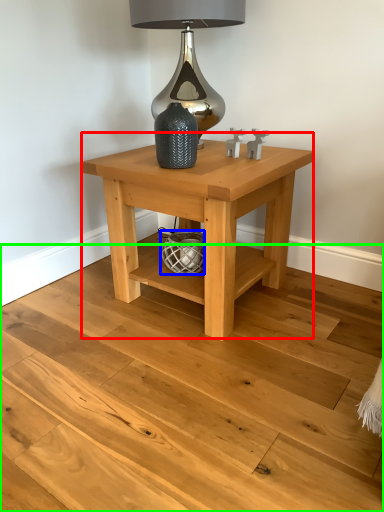
Question: Which is nearer to the table (highlighted by a red box)? basket (highlighted by a blue box) or stair (highlighted by a green box).

Choices:
 (A) basket
 (B) stair

Answer: (A)